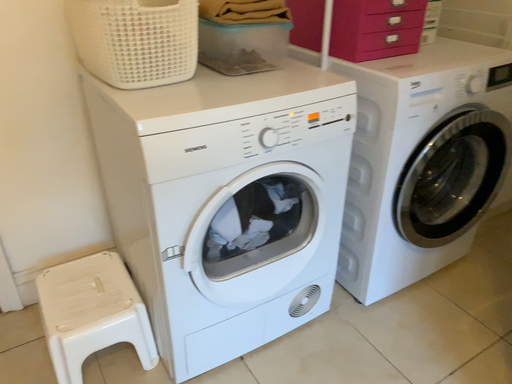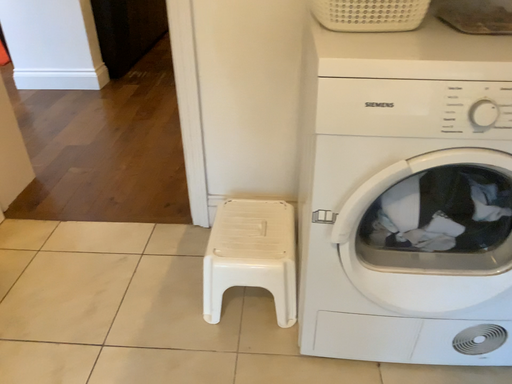
Question: How did the camera likely rotate when shooting the video?

Choices:
 (A) rotated left
 (B) rotated right

Answer: (A)